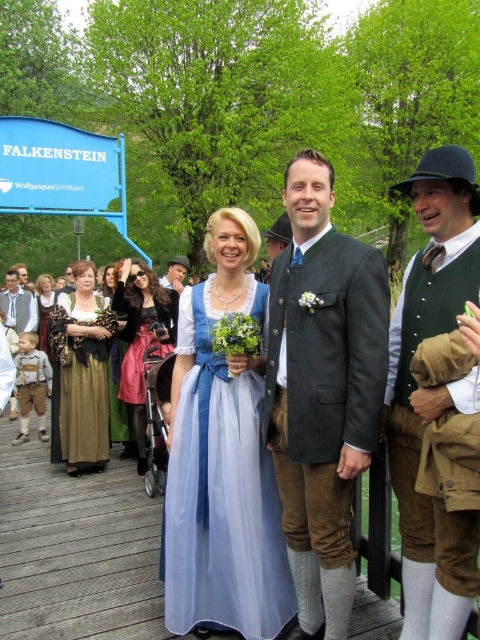
Question: Considering the real-world distances, which object is closest to the matte brown dress at center?

Choices:
 (A) velvet red dress at center
 (B) gold brocade dress at left
 (C) velvet pink dress at center

Answer: (C)

Question: Among these points, which one is nearest to the camera?

Choices:
 (A) (19, 326)
 (B) (214, 518)

Answer: (B)

Question: Can you confirm if gold brocade dress at left is smaller than matte brown dress at center?

Choices:
 (A) no
 (B) yes

Answer: (B)

Question: Among these points, which one is nearest to the camera?

Choices:
 (A) (162, 316)
 (B) (108, 292)

Answer: (A)

Question: Is velvet pink dress at center positioned at the back of velvet red dress at center?

Choices:
 (A) no
 (B) yes

Answer: (A)

Question: Is dark gray suede jacket at center thinner than velvet red dress at center?

Choices:
 (A) yes
 (B) no

Answer: (A)